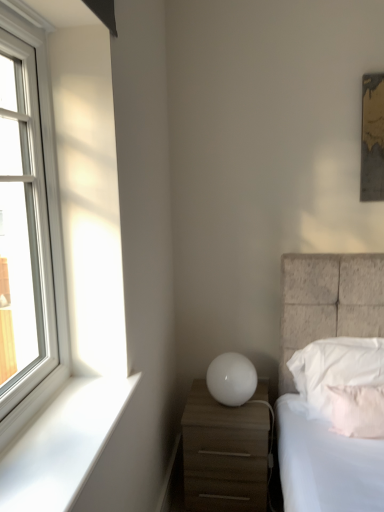
Image resolution: width=384 pixels, height=512 pixels. Identify the location of white matte nightstand at lower right. (224, 454).

The height and width of the screenshot is (512, 384). Describe the element at coordinates (231, 379) in the screenshot. I see `white glossy sphere at center` at that location.

Locate an element on the screen. white soft pillow at right, the first pillow when ordered from back to front is located at coordinates (344, 382).

Identify the location of white matte nightstand at lower right. (224, 454).

Which point is more forward, (54, 273) or (263, 409)?

Point (54, 273)

Is white glass window at left in front of or behind white matte nightstand at lower right in the image?

Clearly, white glass window at left is in front of white matte nightstand at lower right.

From the image's perspective, is white glass window at left located above or below white matte nightstand at lower right?

From the image's perspective, white glass window at left appears above white matte nightstand at lower right.

How many degrees apart are the facing directions of white glass window at left and white matte nightstand at lower right?

89.8 degrees.

Find the location of a particular element. The image size is (384, 512). pillow that appears behind the pink fabric pillow at lower right, which appears as the 2th pillow when viewed from the back is located at coordinates (344, 382).

Considering the sizes of objects pink fabric pillow at lower right, the first pillow when ordered from front to back, and white soft pillow at right, which is the 2th pillow in front-to-back order, in the image provided, who is shorter, pink fabric pillow at lower right, the first pillow when ordered from front to back, or white soft pillow at right, which is the 2th pillow in front-to-back order,?

Standing shorter between the two is pink fabric pillow at lower right, the first pillow when ordered from front to back.

Can you tell me how much pink fabric pillow at lower right, which appears as the 2th pillow when viewed from the back, and white soft pillow at right, which is the 2th pillow in front-to-back order, differ in facing direction?

There is a 5.32-degree angle between the facing directions of pink fabric pillow at lower right, which appears as the 2th pillow when viewed from the back, and white soft pillow at right, which is the 2th pillow in front-to-back order.

Where is `the 1st pillow counting from the right side of the white smooth window sill at lower left`? The width and height of the screenshot is (384, 512). the 1st pillow counting from the right side of the white smooth window sill at lower left is located at coordinates (344, 382).

Is white smooth window sill at lower left oriented towards white soft pillow at right, the first pillow when ordered from back to front?

No, white smooth window sill at lower left does not turn towards white soft pillow at right, the first pillow when ordered from back to front.

Which object is wider, white smooth window sill at lower left or white soft pillow at right, which is the 2th pillow in front-to-back order?

With larger width is white smooth window sill at lower left.

Considering the sizes of white soft pillow at right, the first pillow when ordered from back to front, and white smooth window sill at lower left in the image, is white soft pillow at right, the first pillow when ordered from back to front, bigger or smaller than white smooth window sill at lower left?

Clearly, white soft pillow at right, the first pillow when ordered from back to front, is larger in size than white smooth window sill at lower left.

Locate an element on the screen. The width and height of the screenshot is (384, 512). window sill to the left of white soft pillow at right, which is the 2th pillow in front-to-back order is located at coordinates (62, 445).

Which object is further away from the camera, white soft pillow at right, which is the 2th pillow in front-to-back order, or white smooth window sill at lower left?

white soft pillow at right, which is the 2th pillow in front-to-back order, is behind.

From the image's perspective, is white soft pillow at right, which is the 2th pillow in front-to-back order, under white smooth window sill at lower left?

Yes.

Based on the photo, is white glass window at left a part of white soft pillow at right, the first pillow when ordered from back to front?

No, white glass window at left is not inside white soft pillow at right, the first pillow when ordered from back to front.

Is white soft pillow at right, the first pillow when ordered from back to front, oriented away from white glass window at left?

No, white soft pillow at right, the first pillow when ordered from back to front,'s orientation is not away from white glass window at left.

From a real-world perspective, is white soft pillow at right, which is the 2th pillow in front-to-back order, beneath white glass window at left?

Yes, from a real-world perspective, white soft pillow at right, which is the 2th pillow in front-to-back order, is beneath white glass window at left.

Considering the sizes of white glass window at left and white glossy sphere at center in the image, is white glass window at left wider or thinner than white glossy sphere at center?

white glass window at left is thinner than white glossy sphere at center.

Image resolution: width=384 pixels, height=512 pixels. I want to click on window on the left side of white glossy sphere at center, so click(x=50, y=230).

Is white glass window at left placed right next to white glossy sphere at center?

They are not placed beside each other.

Which object is positioned more to the left, white glass window at left or white glossy sphere at center?

Positioned to the left is white glass window at left.

Locate an element on the screen. window in front of the white matte nightstand at lower right is located at coordinates (50, 230).

From a real-world perspective, is white matte nightstand at lower right located higher than white glass window at left?

No, from a real-world perspective, white matte nightstand at lower right is not on top of white glass window at left.

Is there a large distance between white matte nightstand at lower right and white glass window at left?

No, white matte nightstand at lower right is not far away from white glass window at left.

The image size is (384, 512). In order to click on window on the left of the white matte nightstand at lower right in this screenshot , I will do `click(50, 230)`.

Identify the location of pillow above the pink fabric pillow at lower right, which appears as the 2th pillow when viewed from the back (from the image's perspective). (344, 382).

When comparing their distances from pink fabric pillow at lower right, which appears as the 2th pillow when viewed from the back, does white smooth window sill at lower left or white glass window at left seem closer?

Among the two, white smooth window sill at lower left is located nearer to pink fabric pillow at lower right, which appears as the 2th pillow when viewed from the back.

Considering their positions, is white matte nightstand at lower right positioned closer to white glossy sphere at center than white glass window at left?

white matte nightstand at lower right lies closer to white glossy sphere at center than the other object.

Based on the photo, based on their spatial positions, is white glass window at left or white glossy sphere at center further from white soft pillow at right, the first pillow when ordered from back to front?

white glass window at left is further to white soft pillow at right, the first pillow when ordered from back to front.

Based on their spatial positions, is white matte nightstand at lower right or white glossy sphere at center closer to pink fabric pillow at lower right, which appears as the 2th pillow when viewed from the back?

Among the two, white glossy sphere at center is located nearer to pink fabric pillow at lower right, which appears as the 2th pillow when viewed from the back.

Which object lies further to the anchor point pink fabric pillow at lower right, which appears as the 2th pillow when viewed from the back, white matte nightstand at lower right or white smooth window sill at lower left?

white smooth window sill at lower left.

Which object lies further to the anchor point white smooth window sill at lower left, pink fabric pillow at lower right, which appears as the 2th pillow when viewed from the back, or white glossy sphere at center?

Among the two, pink fabric pillow at lower right, which appears as the 2th pillow when viewed from the back, is located further to white smooth window sill at lower left.

When comparing their distances from white smooth window sill at lower left, does white glass window at left or pink fabric pillow at lower right, the first pillow when ordered from front to back, seem closer?

The object closer to white smooth window sill at lower left is white glass window at left.

Estimate the real-world distances between objects in this image. Which object is closer to pink fabric pillow at lower right, which appears as the 2th pillow when viewed from the back, white soft pillow at right, the first pillow when ordered from back to front, or white smooth window sill at lower left?

white soft pillow at right, the first pillow when ordered from back to front, is positioned closer to the anchor pink fabric pillow at lower right, which appears as the 2th pillow when viewed from the back.

Image resolution: width=384 pixels, height=512 pixels. What are the coordinates of `nightstand positioned between white smooth window sill at lower left and white glossy sphere at center from near to far` in the screenshot? It's located at (224, 454).

Locate an element on the screen. window sill situated between white glass window at left and pink fabric pillow at lower right, the first pillow when ordered from front to back, from left to right is located at coordinates (62, 445).

I want to click on window sill between white glass window at left and white soft pillow at right, the first pillow when ordered from back to front, so click(62, 445).

This screenshot has width=384, height=512. Identify the location of pillow between white matte nightstand at lower right and pink fabric pillow at lower right, the first pillow when ordered from front to back, from left to right. (344, 382).